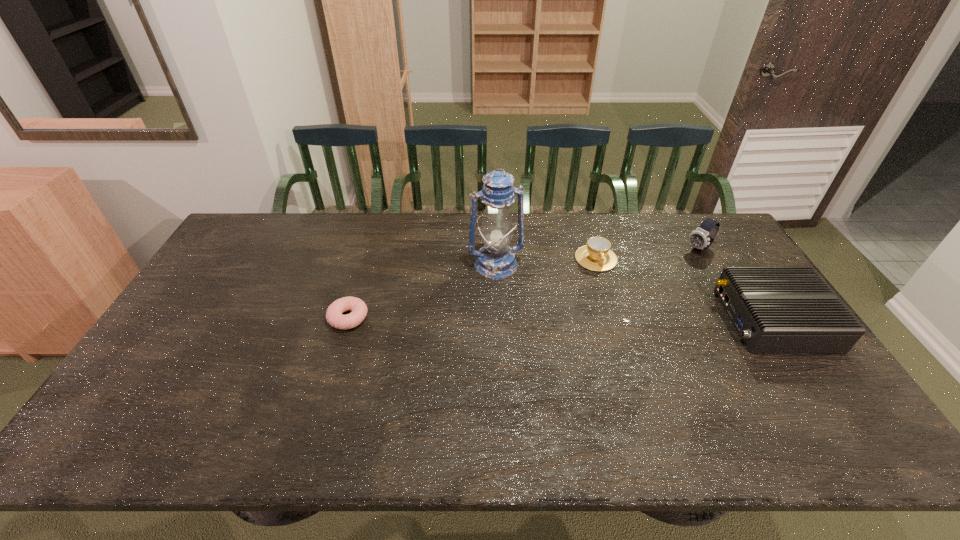
This screenshot has height=540, width=960. In order to click on vacant space located on the back panel of the router in this screenshot , I will do `click(627, 320)`.

Identify the location of vacant region located on the back panel of the router. Image resolution: width=960 pixels, height=540 pixels. (607, 320).

Where is `free spot located on the front-facing side of the fourth object from right to left`? Image resolution: width=960 pixels, height=540 pixels. free spot located on the front-facing side of the fourth object from right to left is located at coordinates (508, 299).

Locate an element on the screen. The width and height of the screenshot is (960, 540). free spot located on the front-facing side of the fourth object from right to left is located at coordinates coord(512,310).

Where is `vacant area located on the front-facing side of the fourth object from right to left`? vacant area located on the front-facing side of the fourth object from right to left is located at coordinates (521, 339).

At what (x,y) coordinates should I click in order to perform the action: click on vacant space positioned 0.160m with the handle on the side of the third object from right to left. Please return your answer as a coordinate pair (x, y). Looking at the image, I should click on (616, 308).

You are a GUI agent. You are given a task and a screenshot of the screen. Output one action in this format:
    pyautogui.click(x=<x>, y=<y>)
    Task: Click on the free spot located with the handle on the side of the third object from right to left
    The height and width of the screenshot is (540, 960).
    Given the screenshot: What is the action you would take?
    pyautogui.click(x=608, y=287)

At what (x,y) coordinates should I click in order to perform the action: click on vacant space located with the handle on the side of the third object from right to left. Please return your answer as a coordinate pair (x, y). Looking at the image, I should click on click(612, 296).

Identify the location of vacant space located 0.220m on the face of the watch. (651, 281).

Where is `blank space located on the face of the watch`? The width and height of the screenshot is (960, 540). blank space located on the face of the watch is located at coordinates (671, 268).